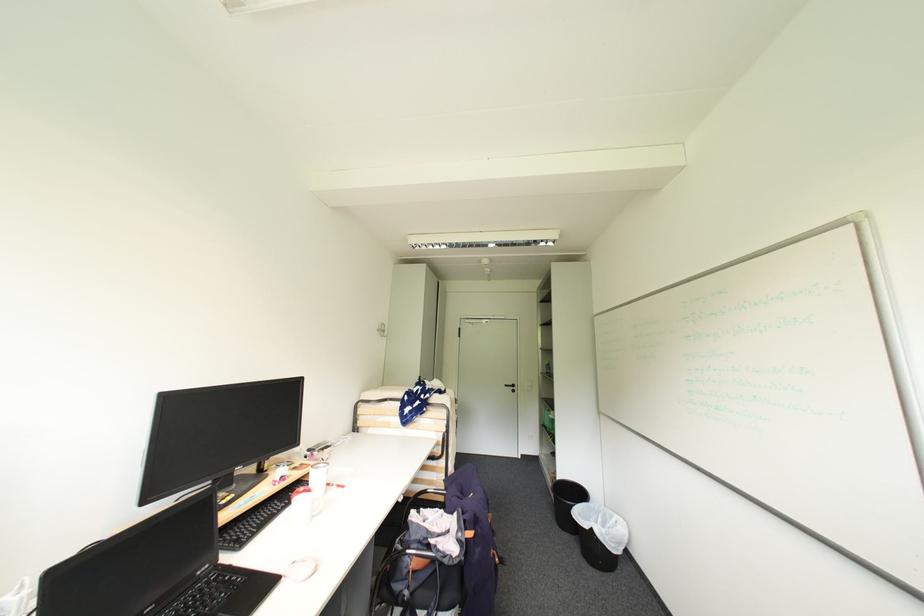
What do you see at coordinates (382, 330) in the screenshot? I see `the metal wall hook` at bounding box center [382, 330].